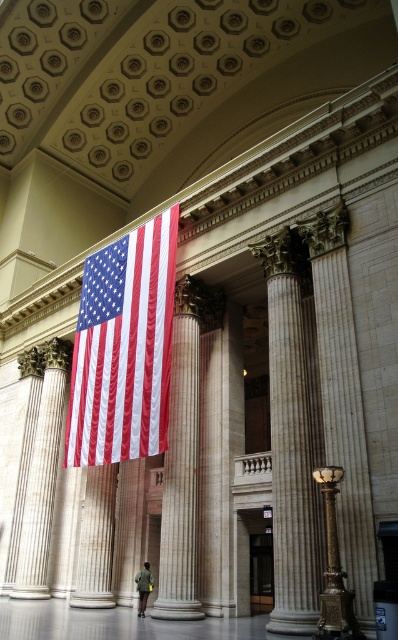
Is point (169, 419) less distant than point (148, 563)?

Yes.

I want to click on beige marble column at center, so click(x=181, y=481).

Is matte fabric flag at center thinner than beige marble column at center?

No.

Which is behind, point (154, 448) or point (165, 502)?

Positioned behind is point (165, 502).

Measure the distance between point [140,381] and camera.

Point [140,381] and camera are 41.24 meters apart from each other.

Where is `matte fabric flag at center`? The image size is (398, 640). matte fabric flag at center is located at coordinates (124, 348).

Consider the image. Is matte fabric flag at center below dark green fabric jacket at center?

Actually, matte fabric flag at center is above dark green fabric jacket at center.

Can you confirm if matte fabric flag at center is shorter than dark green fabric jacket at center?

Incorrect, matte fabric flag at center's height does not fall short of dark green fabric jacket at center's.

Does point (109, 365) come farther from viewer compared to point (148, 572)?

Yes, point (109, 365) is farther from viewer.

Identify the location of matte fabric flag at center. (124, 348).